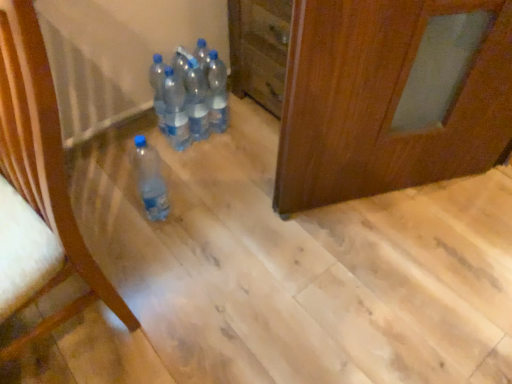
Locate an element on the screen. The height and width of the screenshot is (384, 512). free space behind translucent plastic bottle at lower left, acting as the 4th bottle starting from the right is located at coordinates (x=170, y=177).